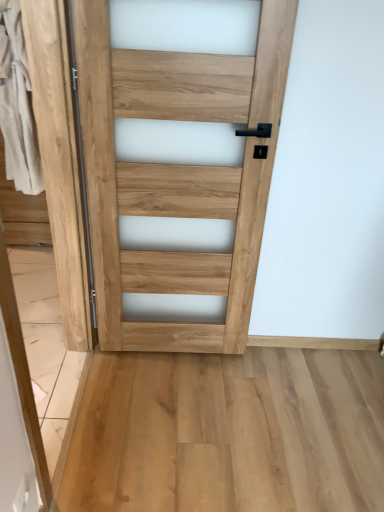
Question: Is natural wood barn door at center taller than natural wood door at center?

Choices:
 (A) yes
 (B) no

Answer: (B)

Question: Is natural wood barn door at center located outside natural wood door at center?

Choices:
 (A) no
 (B) yes

Answer: (B)

Question: Does natural wood barn door at center touch natural wood door at center?

Choices:
 (A) no
 (B) yes

Answer: (A)

Question: Is natural wood barn door at center at the right side of natural wood door at center?

Choices:
 (A) yes
 (B) no

Answer: (B)

Question: Is natural wood door at center inside natural wood barn door at center?

Choices:
 (A) no
 (B) yes

Answer: (A)

Question: Is natural wood barn door at center facing towards natural wood door at center?

Choices:
 (A) yes
 (B) no

Answer: (A)

Question: Is natural wood door at center turned away from natural wood barn door at center?

Choices:
 (A) no
 (B) yes

Answer: (A)

Question: Is natural wood door at center shorter than natural wood barn door at center?

Choices:
 (A) yes
 (B) no

Answer: (B)

Question: From a real-world perspective, is natural wood door at center beneath natural wood barn door at center?

Choices:
 (A) no
 (B) yes

Answer: (A)

Question: From the image's perspective, is natural wood door at center on natural wood barn door at center?

Choices:
 (A) yes
 (B) no

Answer: (A)

Question: Could you tell me if natural wood door at center is turned towards natural wood barn door at center?

Choices:
 (A) yes
 (B) no

Answer: (B)

Question: Is natural wood door at center far away from natural wood barn door at center?

Choices:
 (A) yes
 (B) no

Answer: (B)

Question: Looking at the image, does natural wood barn door at center seem bigger or smaller compared to natural wood door at center?

Choices:
 (A) small
 (B) big

Answer: (B)